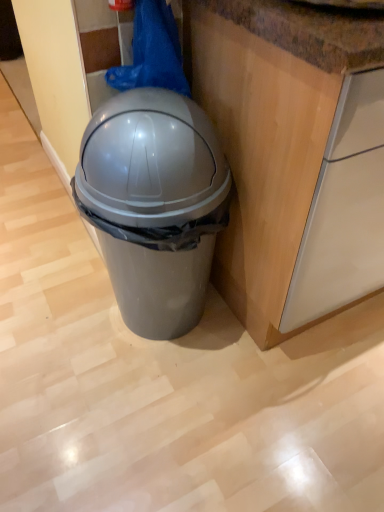
At what (x,y) coordinates should I click in order to perform the action: click on matte gray plastic trash can at center. Please return your answer as a coordinate pair (x, y). Looking at the image, I should click on (154, 205).

The image size is (384, 512). What do you see at coordinates (154, 205) in the screenshot? I see `matte gray plastic trash can at center` at bounding box center [154, 205].

At what (x,y) coordinates should I click in order to perform the action: click on matte gray plastic trash can at center. Please return your answer as a coordinate pair (x, y). Looking at the image, I should click on (154, 205).